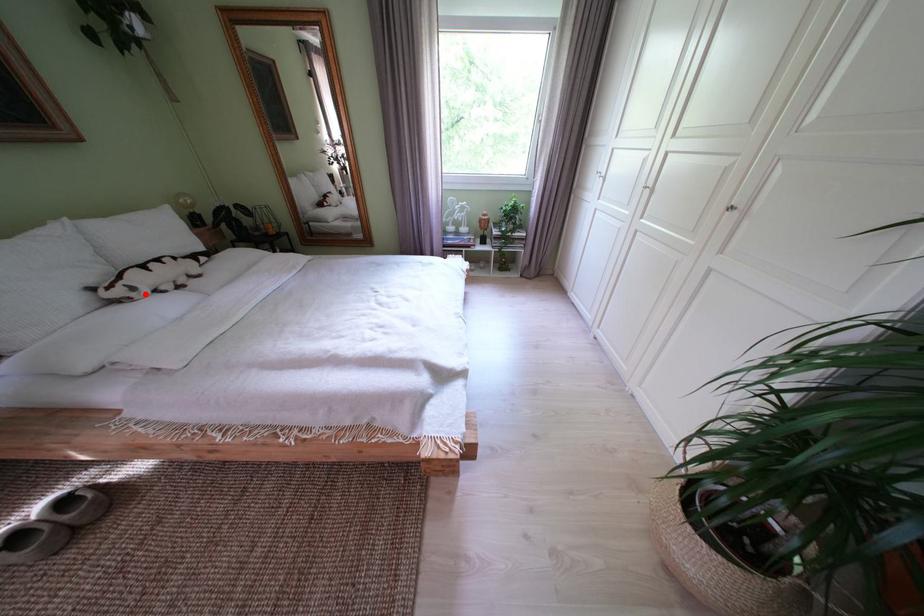
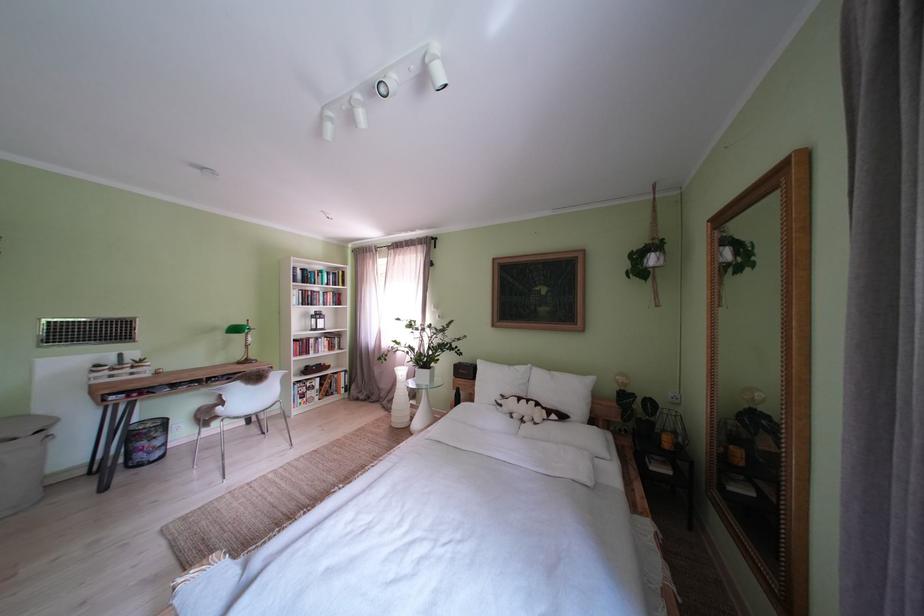
Locate, in the second image, the point that corresponds to the highlighted location in the first image.

(512, 411)